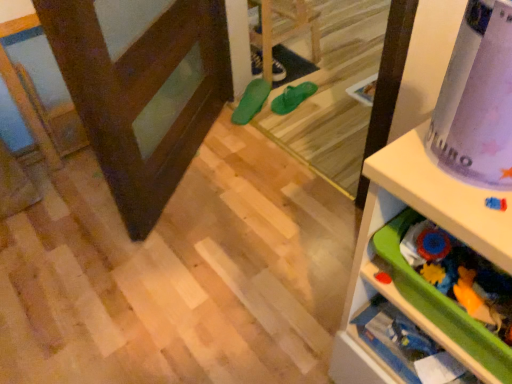
The width and height of the screenshot is (512, 384). What are the coordinates of `vacant area on the back side of green rubber flip-flops at center, the 2th footwear positioned from the back` in the screenshot? It's located at (297, 77).